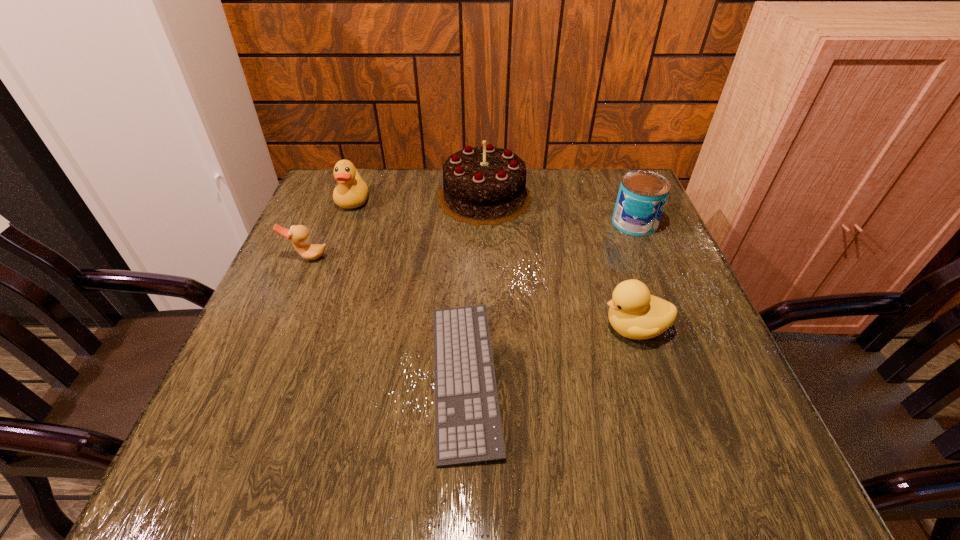
The width and height of the screenshot is (960, 540). I want to click on birthday cake, so click(x=486, y=185).

Where is `the farthest duck`? The width and height of the screenshot is (960, 540). the farthest duck is located at coordinates (352, 191).

I want to click on can, so click(642, 196).

The height and width of the screenshot is (540, 960). In order to click on the rightmost duck in this screenshot , I will do `click(634, 313)`.

Where is `the fourth farthest object`? the fourth farthest object is located at coordinates (298, 234).

This screenshot has height=540, width=960. What are the coordinates of `the shortest duck` in the screenshot? It's located at (298, 234).

Where is `computer keyboard`? The width and height of the screenshot is (960, 540). computer keyboard is located at coordinates 468,426.

You are a GUI agent. You are given a task and a screenshot of the screen. Output one action in this format:
    pyautogui.click(x=<x>, y=<y>)
    Task: Click on the vacant space located on the front of the tallest object
    
    Given the screenshot: What is the action you would take?
    pyautogui.click(x=485, y=260)

The image size is (960, 540). I want to click on vacant space situated at the beak of the farthest duck, so click(325, 276).

Where is `vacant space located 0.310m on the front of the can`? vacant space located 0.310m on the front of the can is located at coordinates (682, 336).